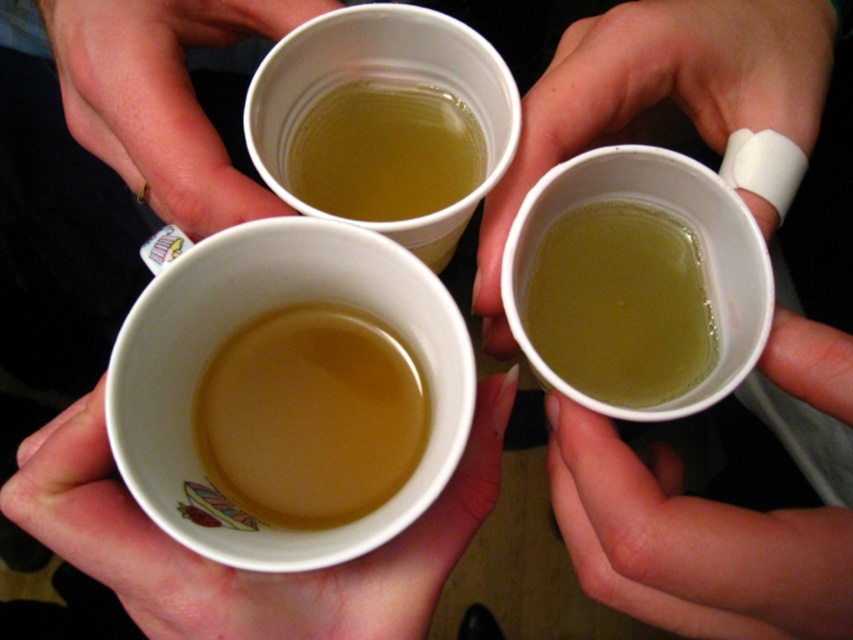
Is point (779, 8) farther from viewer compared to point (396, 156)?

No, (779, 8) is in front of (396, 156).

Identify the location of white bandage at right. The image size is (853, 640). (659, 96).

The width and height of the screenshot is (853, 640). Find the location of `white bandage at right`. white bandage at right is located at coordinates (659, 96).

Who is positioned more to the right, white matte cup at center or yellowish translucent liquid at center?

Positioned to the right is yellowish translucent liquid at center.

Who is more forward, (119, 536) or (579, 208)?

Positioned in front is point (119, 536).

Measure the distance between white matte cup at center and camera.

white matte cup at center and camera are 11.43 inches apart.

At what (x,y) coordinates should I click in order to perform the action: click on white matte cup at center. Please return your answer as a coordinate pair (x, y). This screenshot has height=640, width=853. Looking at the image, I should click on (x=239, y=570).

Image resolution: width=853 pixels, height=640 pixels. Find the location of `white matte cup at center`. white matte cup at center is located at coordinates (239, 570).

Does point (229, 605) lie in front of point (769, 104)?

Yes, it is.

Does point (456, 536) come closer to viewer compared to point (799, 70)?

Yes, point (456, 536) is closer to viewer.

At what (x,y) coordinates should I click in order to perform the action: click on white matte cup at center. Please return your answer as a coordinate pair (x, y). Looking at the image, I should click on (239, 570).